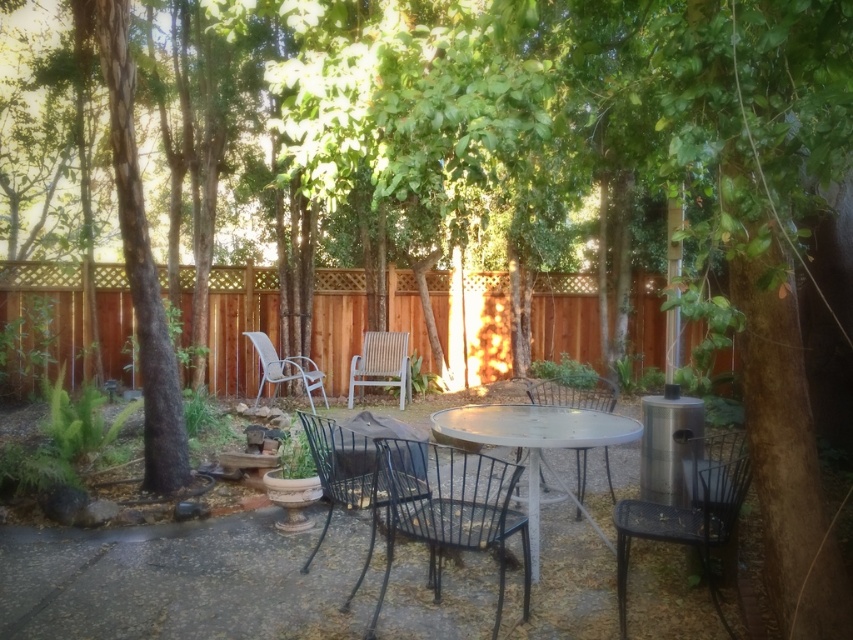
You are a gardener holding a 2.5 meter long hose. You need to water the green textured bark at left from the white metal table at center. Can you reach it without moving the hose nozzle?

The distance between the green textured bark at left and the white metal table at center is 2.59 meters. Since the hose is 2.5 meters long, it is slightly shorter than the distance required. Therefore, you cannot reach the green textured bark at left from the white metal table at center without moving the hose nozzle.